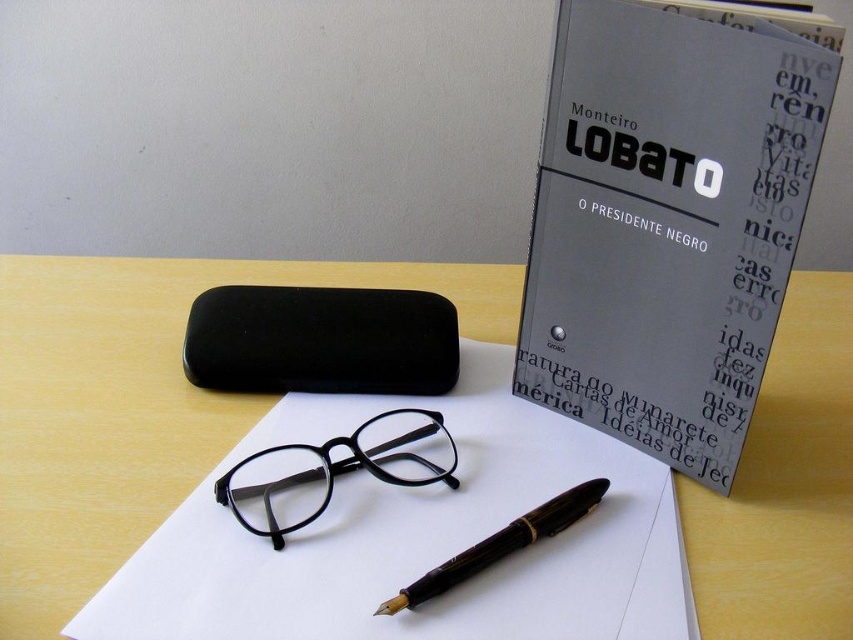
You are organizing items on a desk and notice two points marked on the paper. The first point is labeled as point (498, 269) and the second is point (393, 420). If you want to place a new item so it is directly in front of both points, where should you position it relative to these points?

To place the new item directly in front of both points, it should be positioned closer to point (393, 420) since point (498, 269) is behind it.

You are organizing items on a desk and need to place a new item between the matte gray book at upper right and the black plastic glasses at center. Is there enough space between them to fit a standard notebook?

The matte gray book at upper right is to the right of the black plastic glasses at center, so there is space between them. A standard notebook should fit between the matte gray book at upper right and the black plastic glasses at center.